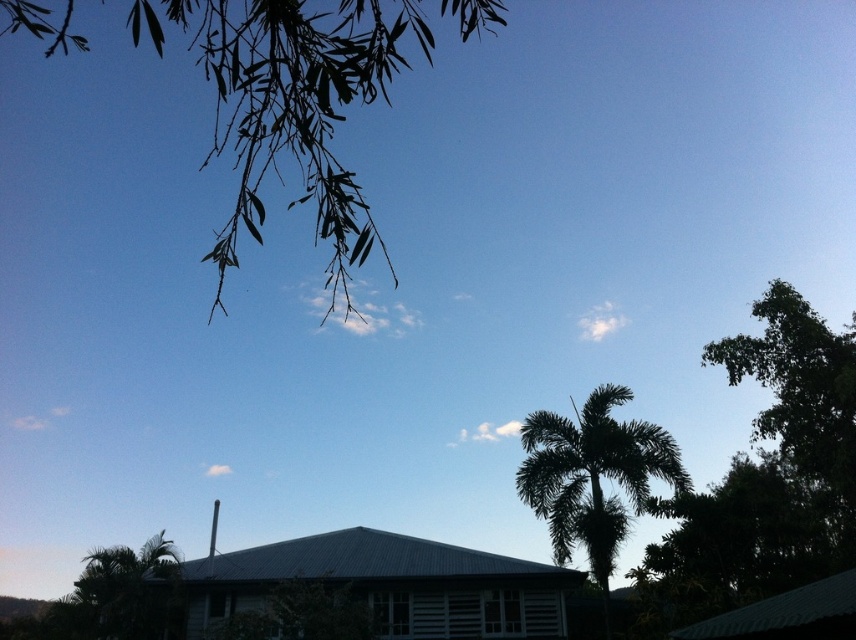
Question: Which object is the farthest from the green leafy branches at upper left?

Choices:
 (A) green leafy palm tree at lower left
 (B) dark green leafy palm tree at center

Answer: (A)

Question: Among these points, which one is nearest to the camera?

Choices:
 (A) (143, 625)
 (B) (302, 196)
 (C) (539, 474)

Answer: (B)

Question: Can you confirm if green leafy branches at upper left is positioned to the left of dark green leafy palm tree at center?

Choices:
 (A) yes
 (B) no

Answer: (A)

Question: In this image, where is green leafy branches at upper left located relative to dark green leafy palm tree at center?

Choices:
 (A) left
 (B) right

Answer: (A)

Question: Which point is farther to the camera?

Choices:
 (A) green leafy branches at upper left
 (B) dark green leafy palm tree at center
 (C) green leafy palm tree at lower left

Answer: (B)

Question: Can you confirm if green leafy branches at upper left is positioned to the left of green leafy palm tree at lower left?

Choices:
 (A) yes
 (B) no

Answer: (A)